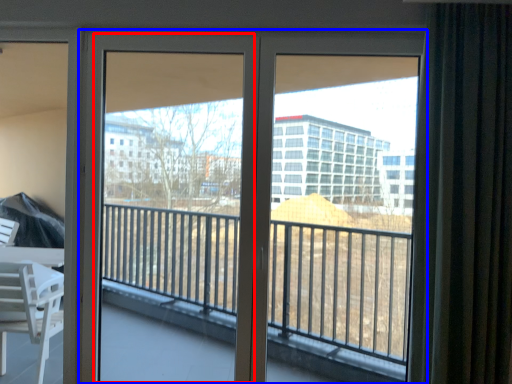
Question: Among these objects, which one is farthest to the camera, screen door (highlighted by a red box) or door (highlighted by a blue box)?

Choices:
 (A) screen door
 (B) door

Answer: (A)